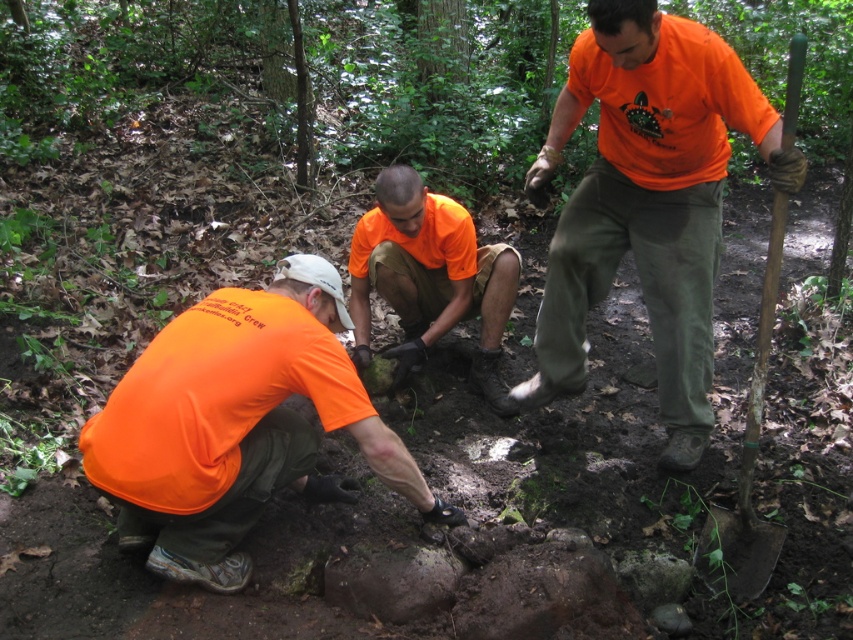
You are a photographer trying to capture a photo of the two matte orange shirts in the scene. Which one, the matte orange shirt at center or the matte orange shirt at lower left, would appear closer to you in the photo?

The matte orange shirt at center would appear closer to you in the photo because it is further to the viewer than the matte orange shirt at lower left.

You are a photographer trying to capture a clear shot of the orange matte shirt at center and the wooden handle shovel at right. Based on their sizes, which object should you focus on first to ensure it appears larger in your photo?

The wooden handle shovel at right is larger than the orange matte shirt at center, so focusing on it first will ensure it appears larger in the photo.

Based on the photo, you are a photographer trying to capture a clear shot of the matte orange shirt at center and the wooden handle shovel at right. Based on their positions, which object should you focus on first to ensure both are in frame?

The matte orange shirt at center is positioned on the left side of wooden handle shovel at right. To ensure both are in frame, focus on the matte orange shirt at center first since it is closer to the left edge, allowing you to adjust the frame to include the shovel on the right.